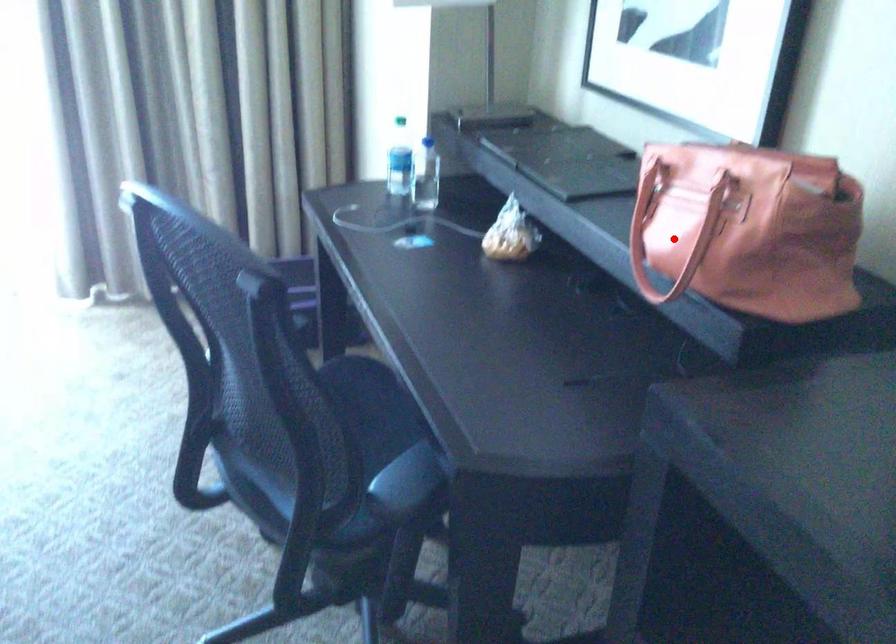
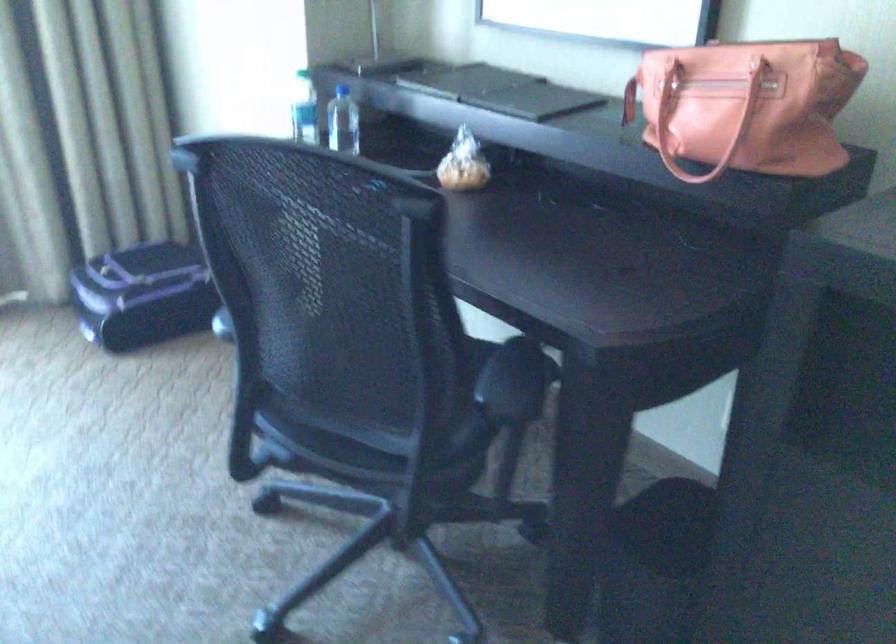
Question: I am providing you with two images of the same scene from different viewpoints. Given a red point in image1, look at the same physical point in image2. Is it:

Choices:
 (A) Closer to the viewpoint
 (B) Farther from the viewpoint

Answer: (B)